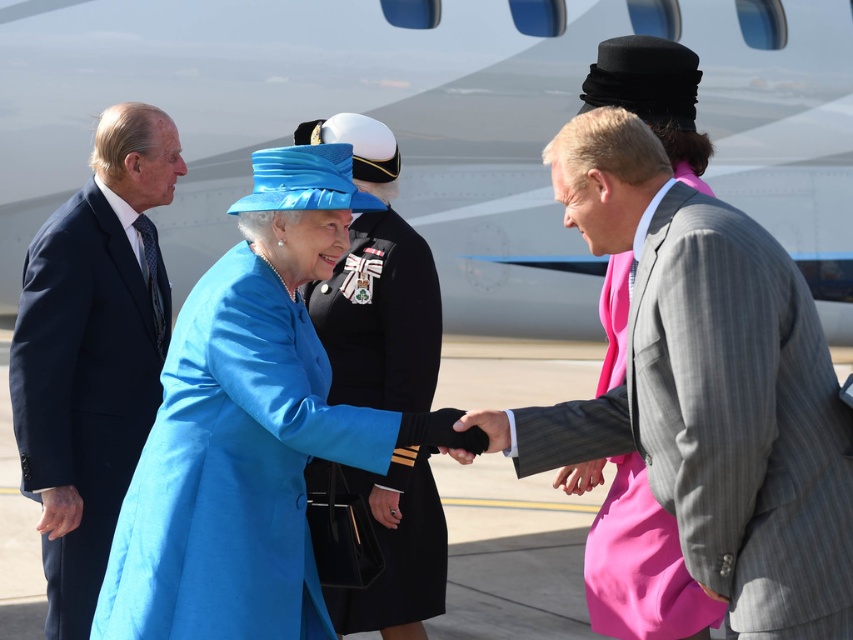
Can you confirm if metallic gray airplane at center is wider than satin blue coat at center?

In fact, metallic gray airplane at center might be narrower than satin blue coat at center.

Between metallic gray airplane at center and satin blue coat at center, which one appears on the left side from the viewer's perspective?

metallic gray airplane at center is more to the left.

Which is in front, point (225, 221) or point (192, 547)?

Positioned in front is point (192, 547).

This screenshot has height=640, width=853. What are the coordinates of `metallic gray airplane at center` in the screenshot? It's located at (433, 125).

This screenshot has width=853, height=640. What are the coordinates of `gray pinstripe suit at center` in the screenshot? It's located at (706, 388).

Describe the element at coordinates (706, 388) in the screenshot. This screenshot has width=853, height=640. I see `gray pinstripe suit at center` at that location.

The height and width of the screenshot is (640, 853). What are the coordinates of `gray pinstripe suit at center` in the screenshot? It's located at (706, 388).

Which is below, gray pinstripe suit at center or navy blue suit at left?

gray pinstripe suit at center is below.

Does gray pinstripe suit at center appear under navy blue suit at left?

Yes.

Which is in front, point (796, 477) or point (39, 349)?

Positioned in front is point (796, 477).

Locate an element on the screen. This screenshot has height=640, width=853. gray pinstripe suit at center is located at coordinates (x=706, y=388).